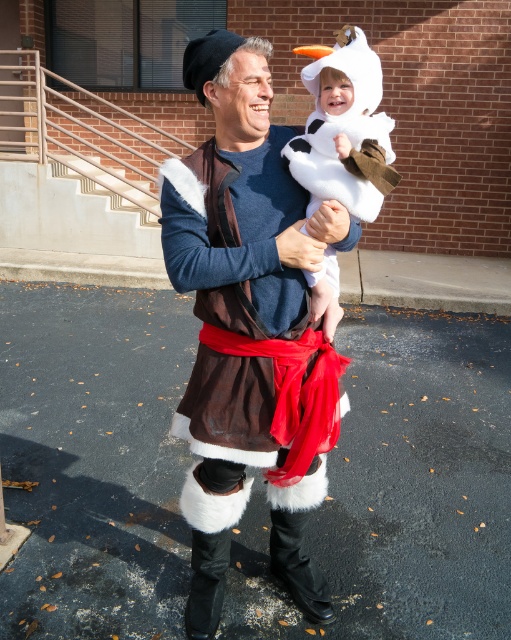
You are taking a photo of the fuzzy brown vest at center and the white fluffy costume at center. Which one will appear larger in your photo?

The fuzzy brown vest at center will appear larger in the photo because it is closer to the viewer than the white fluffy costume at center.

You are a photographer standing at the base of the staircase. You want to take a closeup photo of the fuzzy brown vest at center without moving any objects. Can you step forward to get closer?

The fuzzy brown vest at center is 1.71 meters away from the viewer. Since you are at the base of the staircase, stepping forward would reduce the distance. However, the question allows not moving objects, so stepping forward is possible to get closer within your position.

What is the exact coordinate of the fuzzy brown vest at center?

The fuzzy brown vest at center is located at point (x=248, y=326).